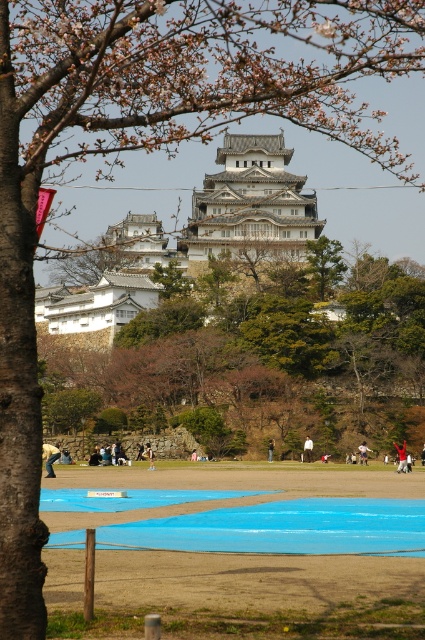
Question: Which point is farther to the camera?

Choices:
 (A) brown textured tree at center
 (B) pink fabric at center
 (C) blue painted ground at center
 (D) green textured tree at center

Answer: (D)

Question: Observing the image, what is the correct spatial positioning of light blue jeans at lower left in reference to pink fabric at center?

Choices:
 (A) right
 (B) left

Answer: (B)

Question: Does brown textured tree at center appear on the right side of light blue jeans at lower left?

Choices:
 (A) no
 (B) yes

Answer: (B)

Question: Which is farther from the blue painted ground at center?

Choices:
 (A) green textured tree at center
 (B) white cotton shirt at center

Answer: (A)

Question: From the image, what is the correct spatial relationship of green textured tree at center in relation to pink fabric at center?

Choices:
 (A) above
 (B) below

Answer: (A)

Question: Which of the following is the closest to the observer?

Choices:
 (A) (416, 444)
 (B) (268, 449)
 (C) (404, 461)

Answer: (C)